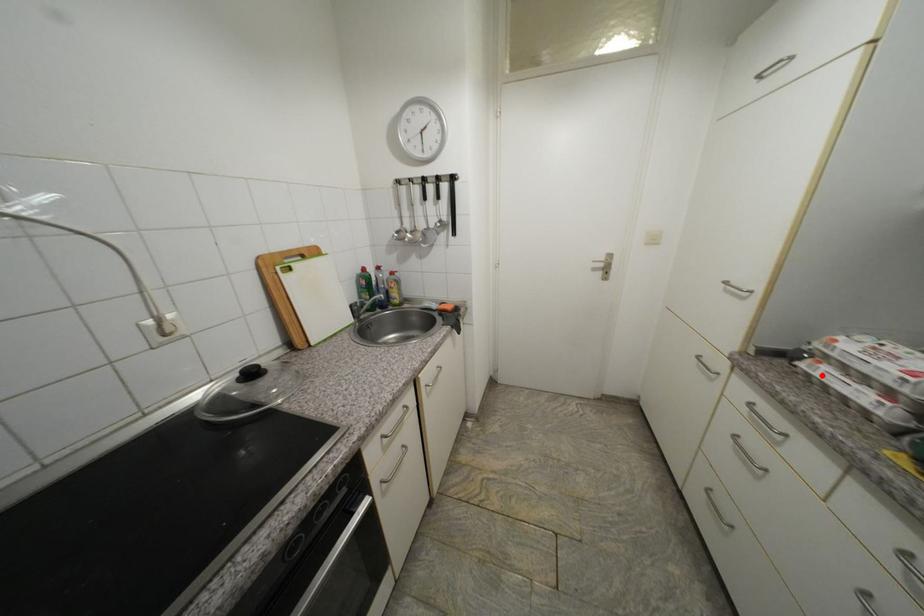
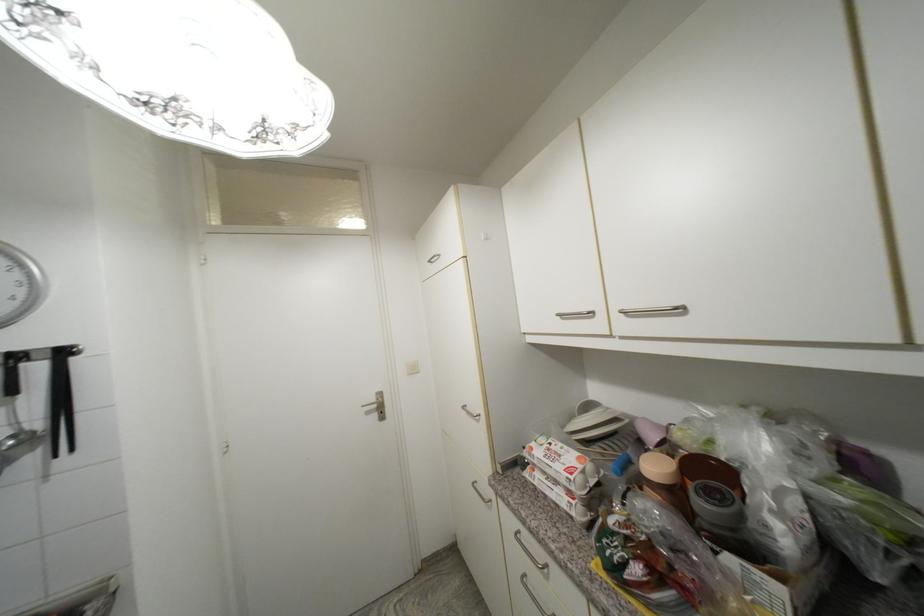
Find the pixel in the second image that matches the highlighted location in the first image.

(541, 485)